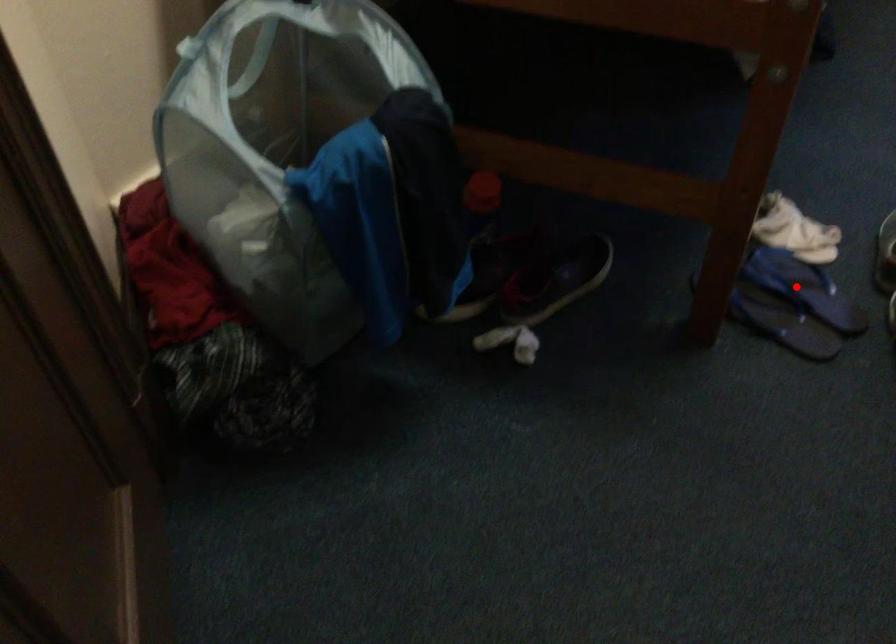
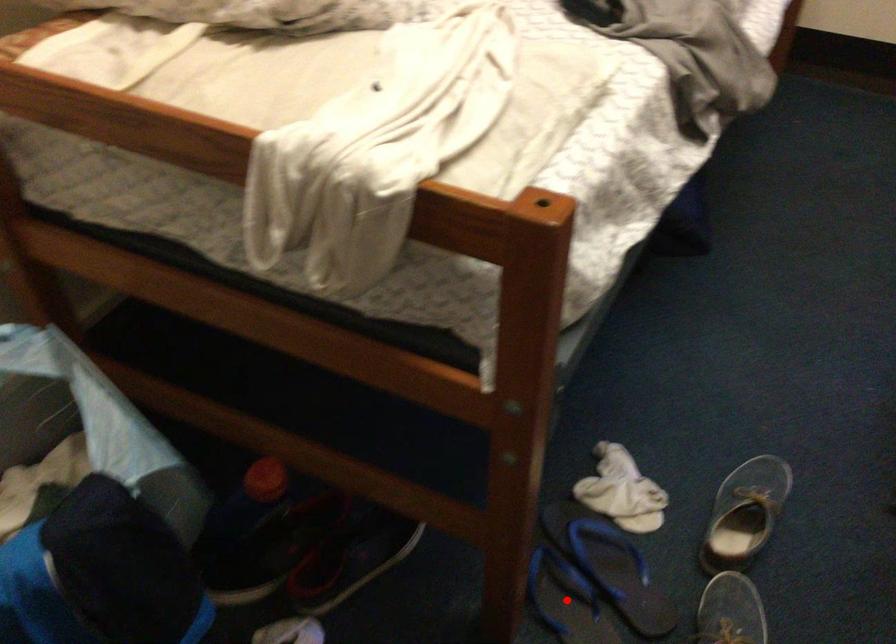
I am providing you with two images of the same scene from different viewpoints. A red point is marked on the first image and another point is marked on the second image. Does the point marked in image1 correspond to the same location as the one in image2?

No